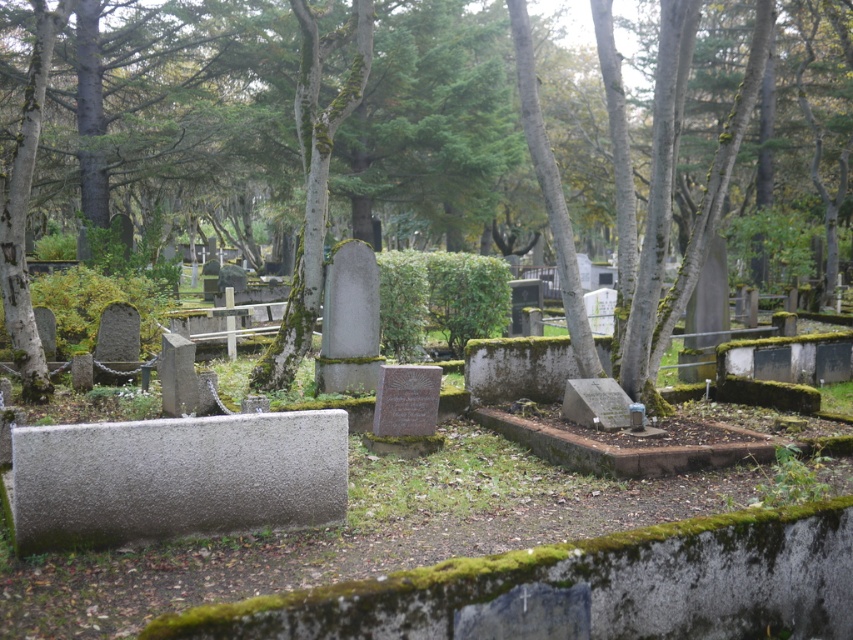
Which is behind, point (233, 573) or point (618, 301)?

The point (618, 301) is more distant.

Is point (589, 477) closer to viewer compared to point (787, 42)?

Yes.

The height and width of the screenshot is (640, 853). In order to click on granite tombstone at center in this screenshot , I will do `click(357, 534)`.

Locate an element on the screen. The width and height of the screenshot is (853, 640). granite tombstone at center is located at coordinates (357, 534).